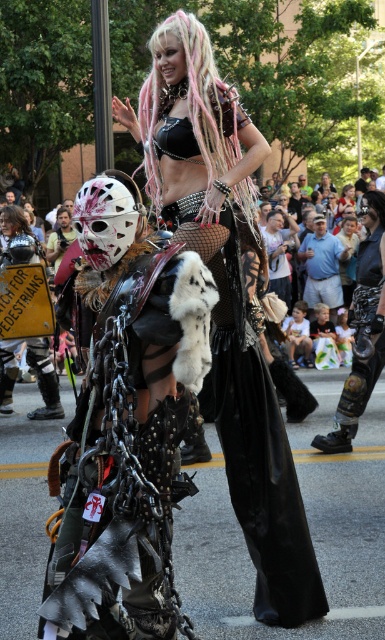
You are a photographer trying to capture a clear shot of both the matte black helmet at left and the metallic chainmail helmet at left. Since you want to ensure both are visible in your frame, which helmet should you focus on first to account for their sizes?

The matte black helmet at left is much taller than the metallic chainmail helmet at left, so you should focus on the matte black helmet at left first to ensure it fits within the frame.

You are a photographer trying to capture the metallic chain armor at center in your shot. You notice a point located at coordinates (130,449). Where exactly is this point located in relation to the metallic chain armor at center?

The point at (130,449) is located on the metallic chain armor at center.

You are a photographer at the festival and want to capture a photo where both the metallic chain armor at center and the pink dreadlocks at center are visible. Based on their positions, which object should you focus on first to ensure both are in frame?

You should focus on the pink dreadlocks at center first because the metallic chain armor at center is positioned below it, so by centering the pink dreadlocks, the metallic chain armor will naturally fall into the lower part of the frame.